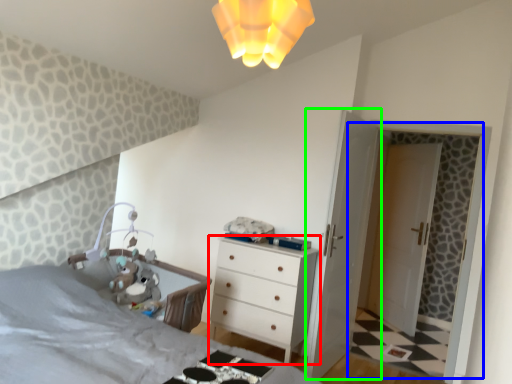
Question: Considering the real-world distances, which object is closest to chest of drawers (highlighted by a red box)? screen door (highlighted by a blue box) or door (highlighted by a green box).

Choices:
 (A) screen door
 (B) door

Answer: (B)